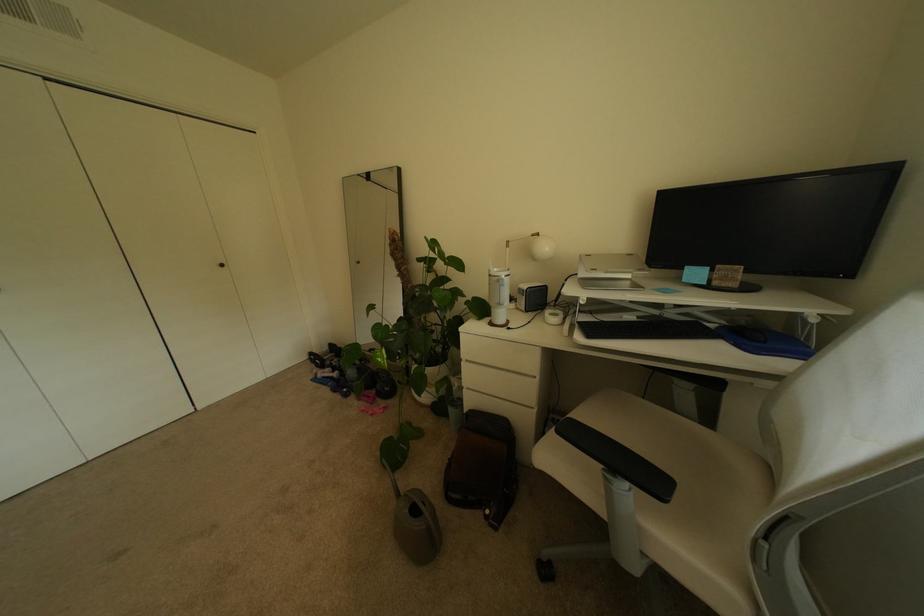
This screenshot has height=616, width=924. I want to click on black keyboard, so 647,330.